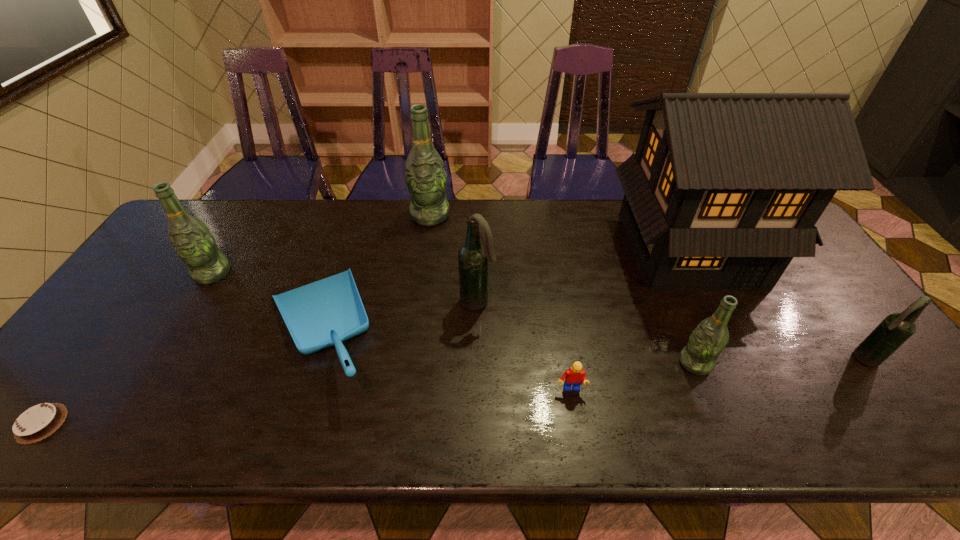
You are a GUI agent. You are given a task and a screenshot of the screen. Output one action in this format:
    pyautogui.click(x=<x>, y=<y>)
    Task: Click on the free space between the third object from left to right and the rightmost green beer bottle
    
    Given the screenshot: What is the action you would take?
    pyautogui.click(x=508, y=346)

Where is `free space between the Lego and the nearest green beer bottle`? This screenshot has height=540, width=960. free space between the Lego and the nearest green beer bottle is located at coordinates (633, 376).

What are the coordinates of `object that is the fifth closest to the dustpan` in the screenshot? It's located at (575, 376).

Locate which object ranks fifth in proximity to the tallest object. Please provide its 2D coordinates. Your answer should be formatted as a tuple, i.e. [(x, y)], where the tuple contains the x and y coordinates of a point satisfying the conditions above.

[(425, 176)]

Point out which beer bottle is positioned as the second nearest to the black dollhouse. Please provide its 2D coordinates. Your answer should be formatted as a tuple, i.e. [(x, y)], where the tuple contains the x and y coordinates of a point satisfying the conditions above.

[(707, 341)]

This screenshot has height=540, width=960. In order to click on beer bottle that is the third closest to the fourth nearest beer bottle in this screenshot , I will do `click(707, 341)`.

Identify which green beer bottle is located as the second nearest to the second smallest green beer bottle. Please provide its 2D coordinates. Your answer should be formatted as a tuple, i.e. [(x, y)], where the tuple contains the x and y coordinates of a point satisfying the conditions above.

[(707, 341)]

This screenshot has width=960, height=540. In order to click on green beer bottle that stands as the closest to the eighth object from right to left in this screenshot , I will do `click(425, 176)`.

You are a GUI agent. You are given a task and a screenshot of the screen. Output one action in this format:
    pyautogui.click(x=<x>, y=<y>)
    Task: Click on the free location that satisfies the following two spatial constraints: 1. on the surface of the dustpan; 2. on the right side of the second nearest green beer bottle
    
    Given the screenshot: What is the action you would take?
    pyautogui.click(x=179, y=329)

Locate an element on the screen. The height and width of the screenshot is (540, 960). free space that satisfies the following two spatial constraints: 1. on the surface of the second beer bottle from left to right; 2. on the right side of the fifth object from right to left is located at coordinates (419, 302).